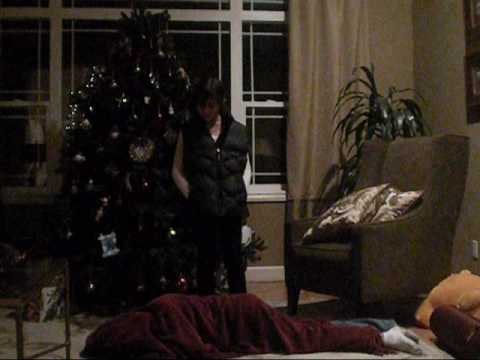
At what (x,y) coordinates should I click in order to perform the action: click on grid windows. Please return your answer as a coordinate pair (x, y). This screenshot has height=360, width=480. Looking at the image, I should click on (255, 61), (187, 51), (28, 53).